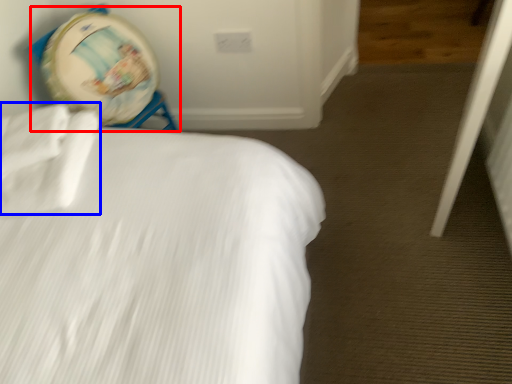
Question: Which object is further to the camera taking this photo, swivel chair (highlighted by a red box) or sheet (highlighted by a blue box)?

Choices:
 (A) swivel chair
 (B) sheet

Answer: (A)